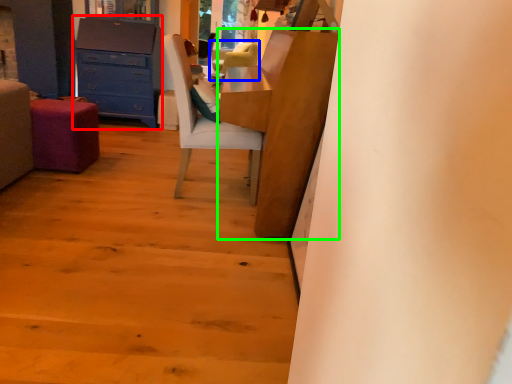
Question: Estimate the real-world distances between objects in this image. Which object is farther from chest of drawers (highlighted by a red box), chair (highlighted by a blue box) or table (highlighted by a green box)?

Choices:
 (A) chair
 (B) table

Answer: (B)